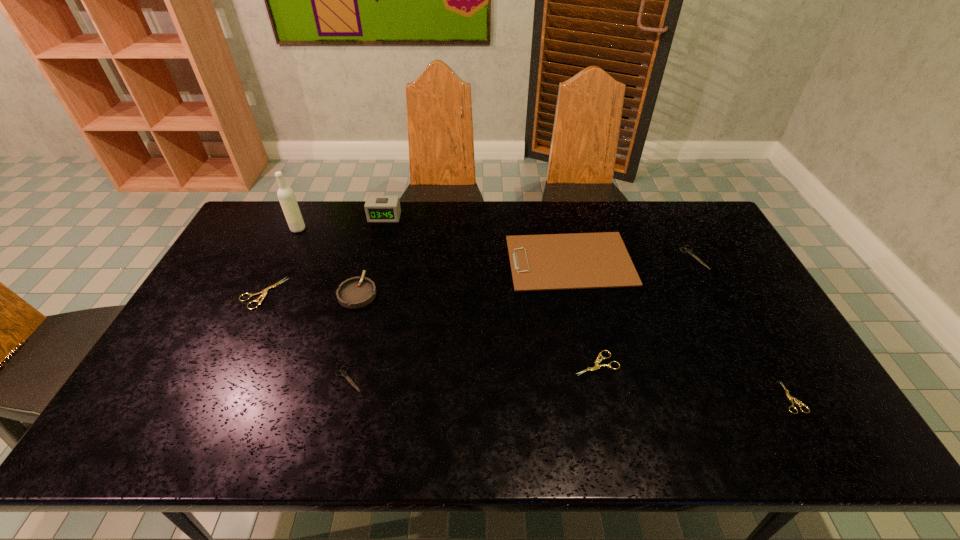
Locate an element on the screen. shears that is the second closest to the leftmost shears is located at coordinates (597, 361).

Locate an element on the screen. The width and height of the screenshot is (960, 540). the fifth closest shears to the tallest object is located at coordinates (790, 398).

Locate an element on the screen. This screenshot has width=960, height=540. beige shears that can be found as the closest to the second biggest beige shears is located at coordinates (790, 398).

This screenshot has height=540, width=960. I want to click on beige shears that is the closest to the smaller black shears, so click(264, 293).

Image resolution: width=960 pixels, height=540 pixels. What are the coordinates of `vacant region that satisfies the following two spatial constraints: 1. on the front-facing side of the farthest object; 2. on the right side of the smallest beige shears` in the screenshot? It's located at (338, 397).

What are the coordinates of `vacant space that satisfies the following two spatial constraints: 1. on the front side of the second biggest beige shears; 2. on the right side of the farthest beige shears` in the screenshot? It's located at (228, 363).